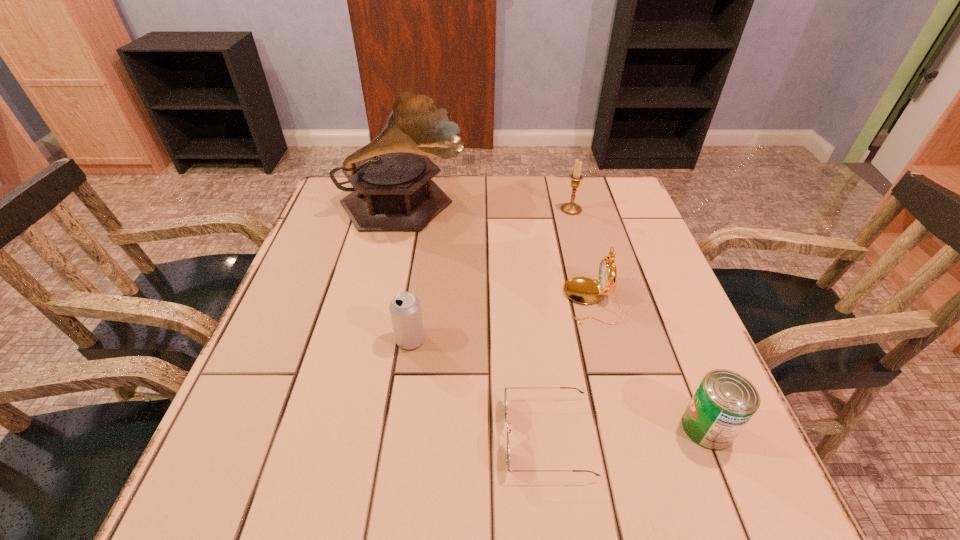
What are the coordinates of `vacant space at the far right corner of the desktop` in the screenshot? It's located at (617, 207).

Identify the location of empty location between the tallest object and the sunglasses. (475, 322).

Image resolution: width=960 pixels, height=540 pixels. Find the location of `free space between the shortest object and the phonograph record`. free space between the shortest object and the phonograph record is located at coordinates (475, 322).

I want to click on free space between the rightmost object and the beer can, so click(x=559, y=383).

The width and height of the screenshot is (960, 540). In order to click on empty space between the candle holder and the fourth object from right to left in this screenshot , I will do [560, 322].

Image resolution: width=960 pixels, height=540 pixels. Find the location of `free space between the candle holder and the sunglasses`. free space between the candle holder and the sunglasses is located at coordinates (560, 322).

At what (x,y) coordinates should I click in order to perform the action: click on free area in between the fourth nearest object and the tallest object. Please return your answer as a coordinate pair (x, y). The image size is (960, 540). Looking at the image, I should click on (496, 254).

The width and height of the screenshot is (960, 540). What are the coordinates of `free space between the tallest object and the sunglasses` in the screenshot? It's located at (475, 322).

Locate an element on the screen. The width and height of the screenshot is (960, 540). free space that is in between the sunglasses and the second tallest object is located at coordinates (560, 322).

Find the location of a particular element. The width and height of the screenshot is (960, 540). vacant space in between the fourth nearest object and the candle holder is located at coordinates (581, 255).